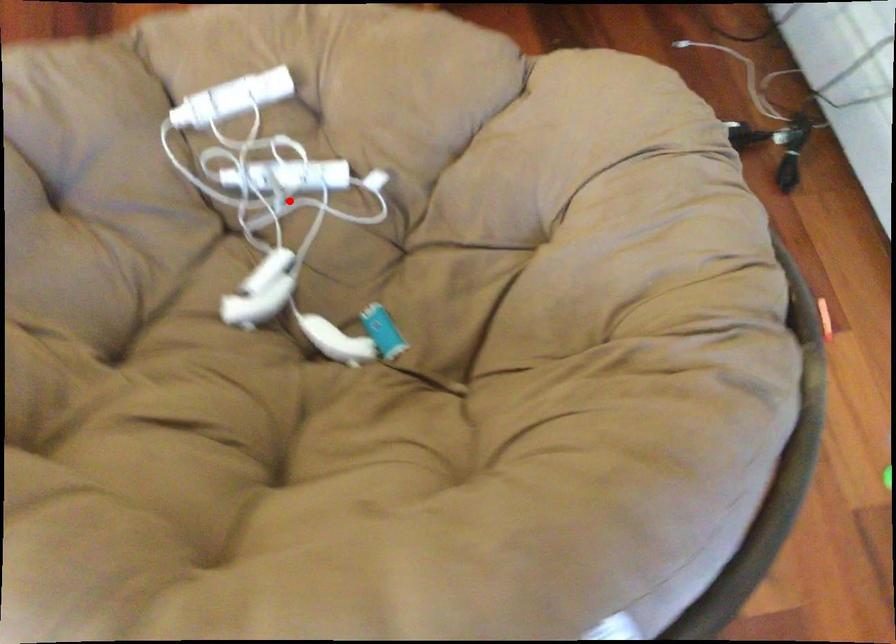
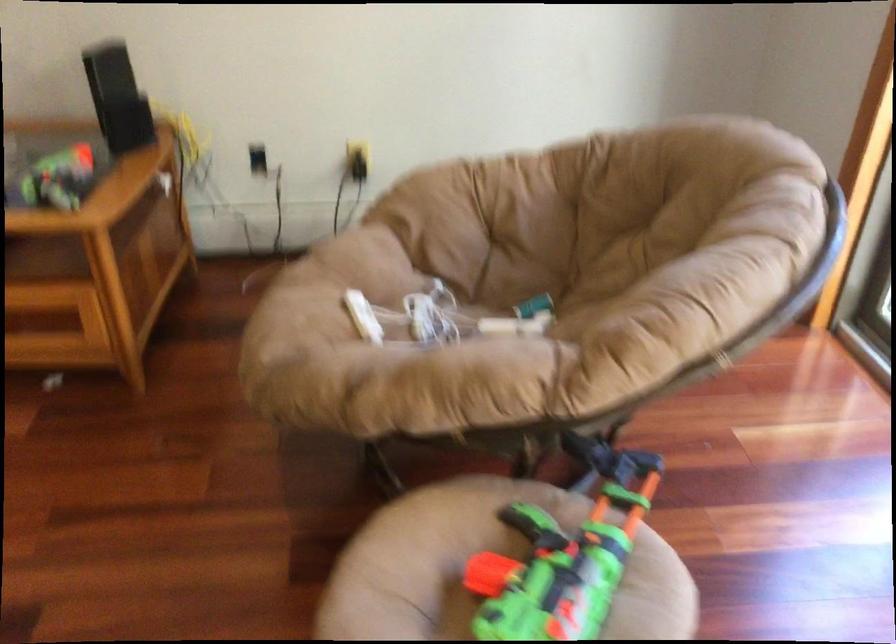
Where in the second image is the point corresponding to the highlighted location from the first image?

(442, 317)